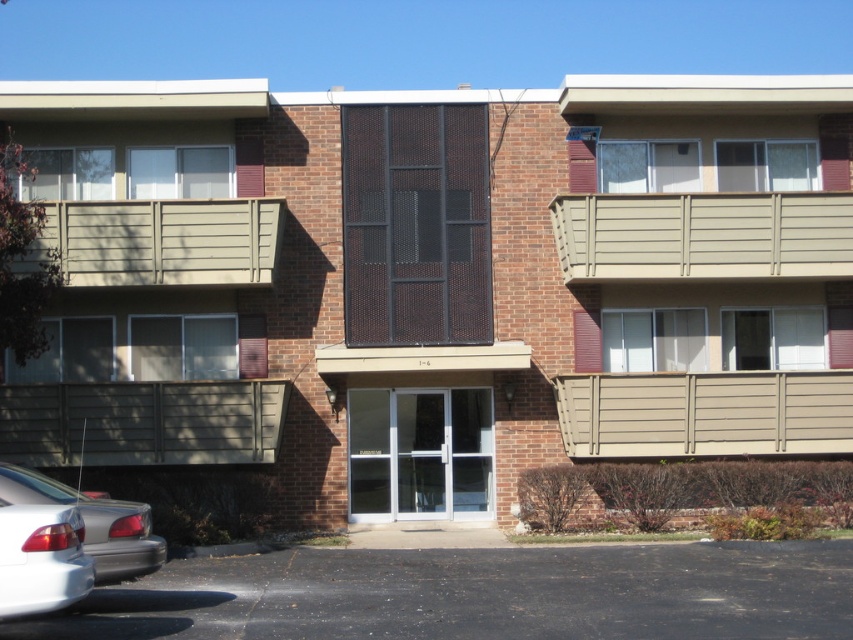
You are a delivery person trying to locate the entrance to the apartment building. You see the brown textured panel at lower left and the beige wood balcony at left. Which object is closer to the entrance?

The brown textured panel at lower left is closer to the entrance because it has a smaller size compared to the beige wood balcony at left, indicating it is positioned lower and nearer to the entrance area.

structural integrity of the building is a concern. The point at coordinates (822, 401) is 19.54 meters away from the viewer. Determine if this distance poses a safety risk for potential falling objects from that point to the ground below.

structural integrity of the building is a concern. The point at coordinates (822, 401) is 19.54 meters away from the viewer. Determine if this distance poses a safety risk for potential falling objects from that point to the ground below.

You are a delivery person with a cart that is 1.8 meters wide. You need to navigate through the space between the brown textured panel at lower left and the beige wood balcony at left to reach the entrance. Can your cart fit through the gap?

The distance between the brown textured panel at lower left and the beige wood balcony at left is 2.03 meters, which is wider than the cart width of 1.8 meters. The cart can fit through the gap.